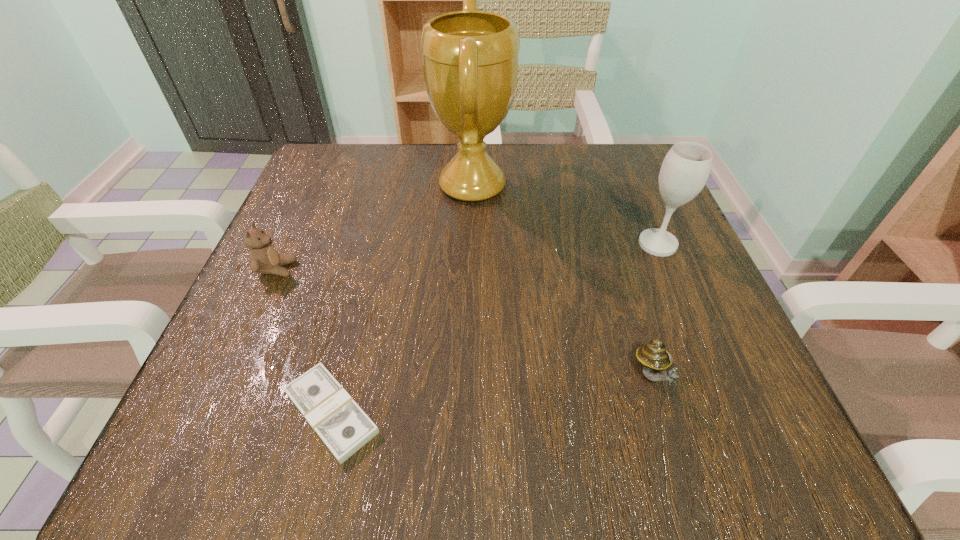
At what (x,y) coordinates should I click in order to perform the action: click on vacant space that satisfies the following two spatial constraints: 1. on the front of the third object from right to left with the decoration; 2. on the back side of the wineglass. Please return your answer as a coordinate pair (x, y). This screenshot has width=960, height=540. Looking at the image, I should click on (471, 244).

This screenshot has height=540, width=960. Find the location of `free point that satisfies the following two spatial constraints: 1. on the front of the rightmost object with the decoration; 2. on the left side of the award`. free point that satisfies the following two spatial constraints: 1. on the front of the rightmost object with the decoration; 2. on the left side of the award is located at coordinates (471, 244).

Find the location of a particular element. The height and width of the screenshot is (540, 960). vacant region that satisfies the following two spatial constraints: 1. on the back side of the wineglass; 2. on the left side of the dollar is located at coordinates (373, 244).

At what (x,y) coordinates should I click in order to perform the action: click on vacant space that satisfies the following two spatial constraints: 1. on the back side of the second object from left to right; 2. on the right side of the rightmost object. Please return your answer as a coordinate pair (x, y). Looking at the image, I should click on (373, 244).